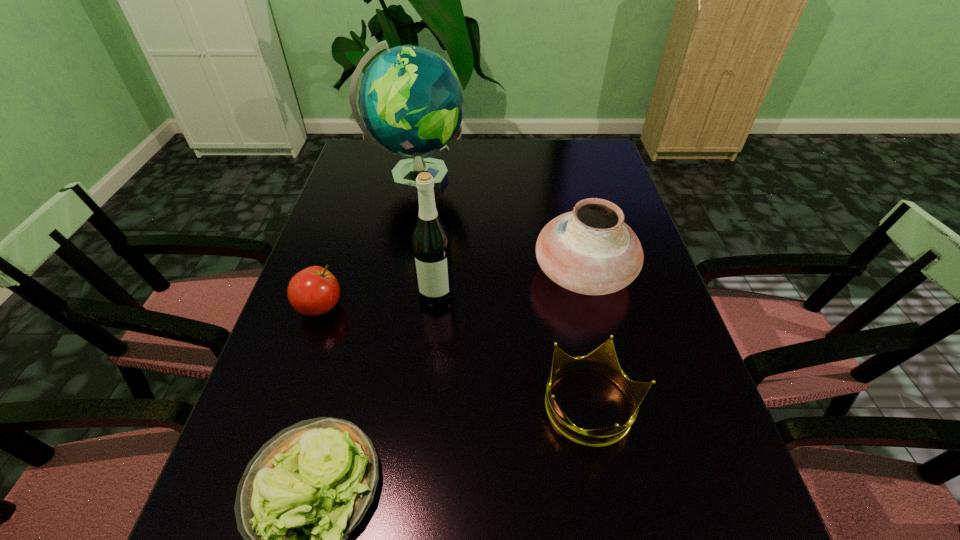
Identify the location of vacant position at the far right corner of the desktop. (577, 171).

Locate an element on the screen. Image resolution: width=960 pixels, height=540 pixels. free space between the fourth shortest object and the wine bottle is located at coordinates (510, 284).

Locate an element on the screen. vacant space that's between the crown and the wine bottle is located at coordinates (514, 350).

Where is `vacant space that's between the farthest object and the apple`? The image size is (960, 540). vacant space that's between the farthest object and the apple is located at coordinates (368, 242).

I want to click on vacant space that is in between the fourth shortest object and the fifth shortest object, so click(510, 284).

Where is `unoccupied area between the farthest object and the apple`? unoccupied area between the farthest object and the apple is located at coordinates (368, 242).

Where is `free space between the third tallest object and the crown`? This screenshot has height=540, width=960. free space between the third tallest object and the crown is located at coordinates (588, 340).

Find the location of a particular element. This screenshot has width=960, height=540. free space between the crown and the tallest object is located at coordinates (504, 292).

The height and width of the screenshot is (540, 960). I want to click on unoccupied area between the farthest object and the crown, so click(x=504, y=292).

Locate which object is the closest to the crown. Please provide its 2D coordinates. Your answer should be formatted as a tuple, i.e. [(x, y)], where the tuple contains the x and y coordinates of a point satisfying the conditions above.

[(590, 250)]